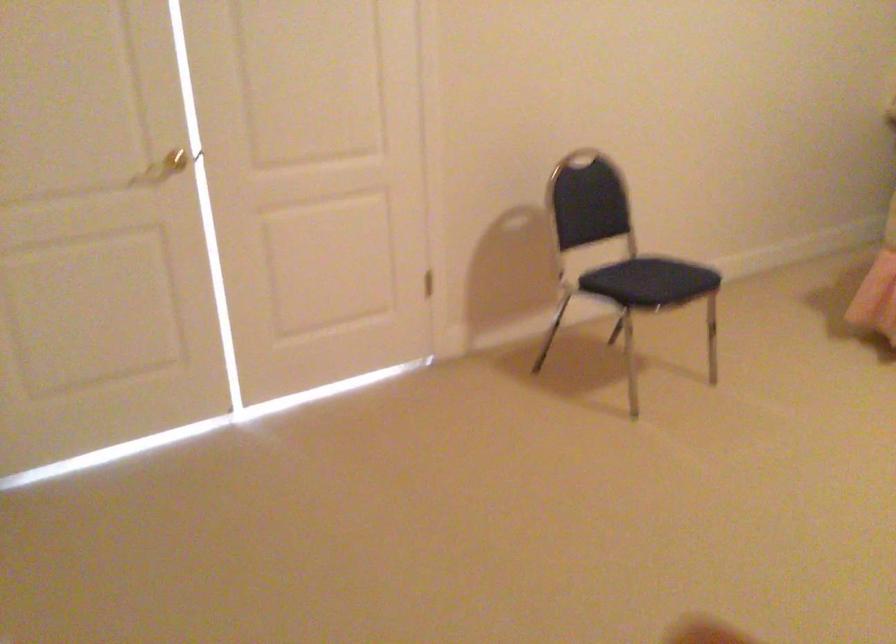
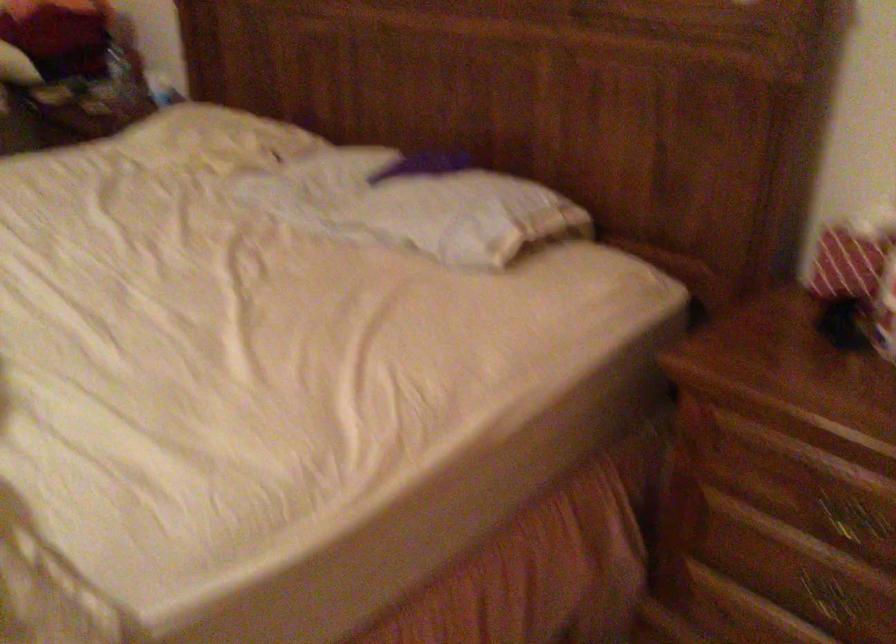
Question: Which direction would the cameraman need to move to produce the second image? Reply with the corresponding letter.

Choices:
 (A) Left
 (B) Right
 (C) Forward
 (D) Backward

Answer: (B)